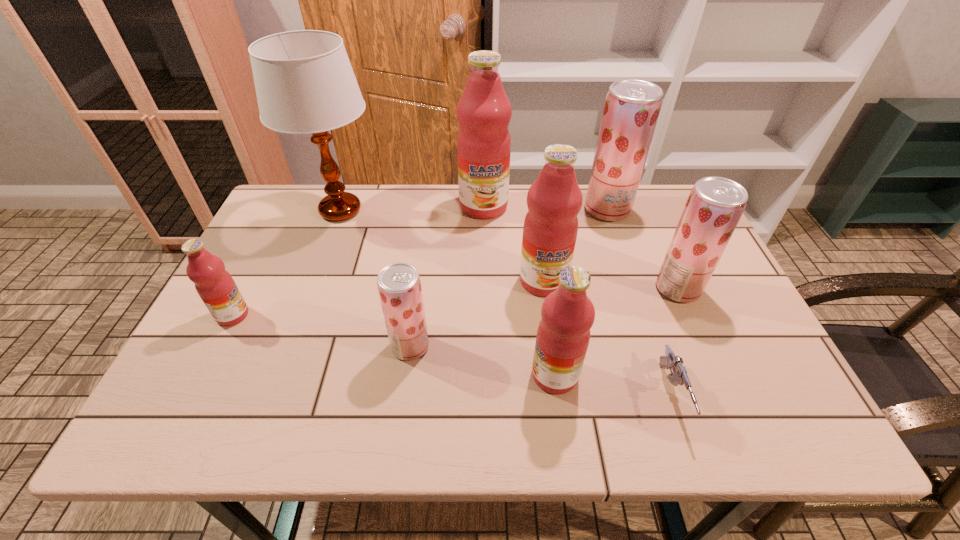
The width and height of the screenshot is (960, 540). I want to click on the third object from left to right, so click(399, 286).

Find the location of a particular element. the shortest object is located at coordinates (679, 376).

Locate an element on the screen. Image resolution: width=960 pixels, height=540 pixels. vacant space located on the right of the table lamp is located at coordinates (474, 211).

The height and width of the screenshot is (540, 960). I want to click on vacant region located on the label of the farthest pink fruit juice, so click(x=484, y=249).

The image size is (960, 540). What are the coordinates of `blank space located 0.320m on the front of the farthest strawberry fruit juice` in the screenshot? It's located at (639, 304).

This screenshot has height=540, width=960. I want to click on vacant region located 0.230m on the label of the third nearest pink fruit juice, so click(557, 379).

You are a GUI agent. You are given a task and a screenshot of the screen. Output one action in this format:
    pyautogui.click(x=<x>, y=<y>)
    Task: Click on the free region located 0.400m on the left of the second smallest strawberry fruit juice
    
    Given the screenshot: What is the action you would take?
    pyautogui.click(x=500, y=288)

Identify the location of free space located on the label of the second smallest pink fruit juice. (503, 375).

You are a GUI agent. You are given a task and a screenshot of the screen. Output one action in this format:
    pyautogui.click(x=<x>, y=<y>)
    Task: Click on the vacant area situated on the label of the second smallest pink fruit juice
    
    Given the screenshot: What is the action you would take?
    pyautogui.click(x=382, y=375)

Find the location of `free space located on the label of the second smallest pink fruit juice`. free space located on the label of the second smallest pink fruit juice is located at coordinates (378, 375).